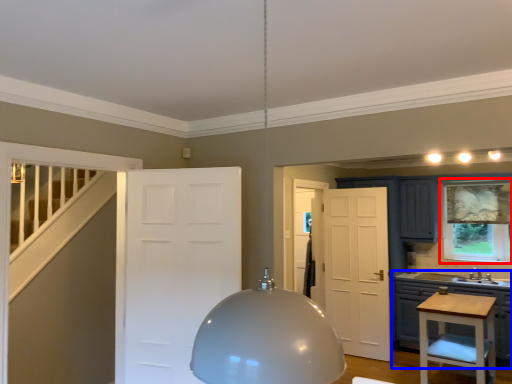
Question: Which of the following is the closest to the observer, window (highlighted by a red box) or cabinetry (highlighted by a blue box)?

Choices:
 (A) window
 (B) cabinetry

Answer: (B)